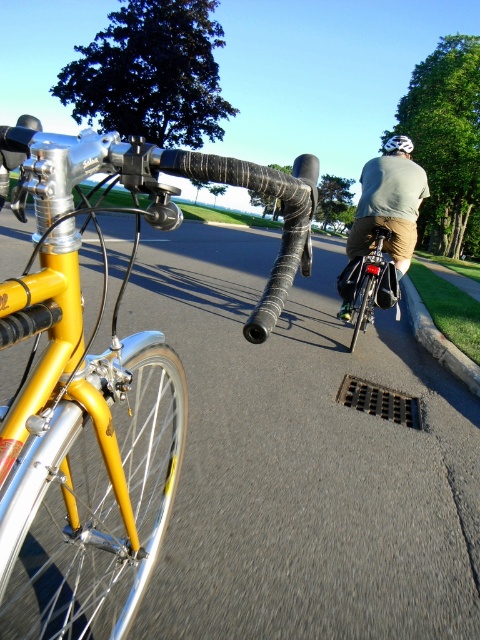
You are a cyclist riding a bike with a 1.5 meter wheelbase. You want to make a sharp turn to avoid an obstacle. The point you need to turn around is at point (70, 193). Can your bike make the turn without the back wheel hitting the obstacle?

The distance between point (70, 193) and the camera is 67.75 centimeters. Since the bike has a 1.5 meter wheelbase, which is longer than the distance to the point, the back wheel will likely hit the obstacle during the turn.

Looking at this image, you are a cyclist looking at the scene from behind the yellow matte bicycle handlebars at center. What direction should you turn to follow the path the other cyclist is taking?

The yellow matte bicycle handlebars at center are positioned at coordinates (101,387), which indicates they are in the lower central part of the image. Since the path curves and the other cyclist is moving away, you should follow the natural curve of the path to stay aligned with their direction.

You are a photographer trying to capture the cyclist in the midground. You notice the light gray fabric shirt at center and the white matte helmet at upper center. Which object should you focus on if you want to photograph the smaller one?

The light gray fabric shirt at center has a smaller size compared to the white matte helmet at upper center, so you should focus on the light gray fabric shirt at center to photograph the smaller one.